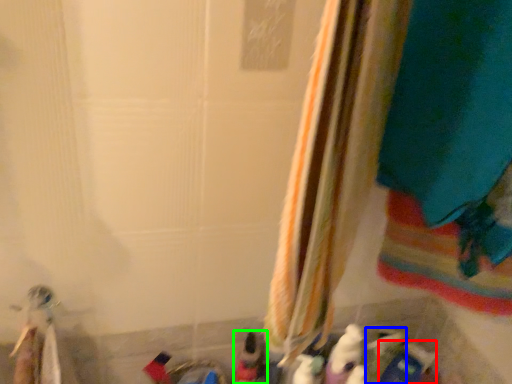
Question: Which is nearer to the toy (highlighted by a red box)? toy (highlighted by a blue box) or toy (highlighted by a green box).

Choices:
 (A) toy
 (B) toy

Answer: (A)